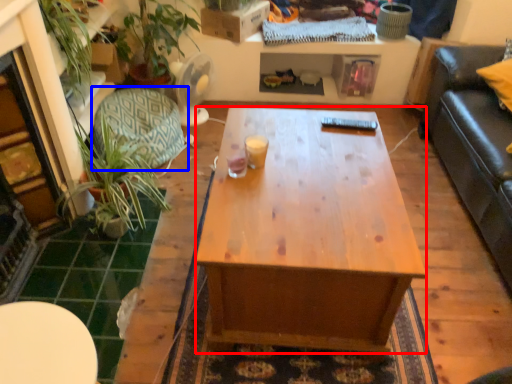
Question: Which object appears farthest to the camera in this image, desk (highlighted by a red box) or swivel chair (highlighted by a blue box)?

Choices:
 (A) desk
 (B) swivel chair

Answer: (B)